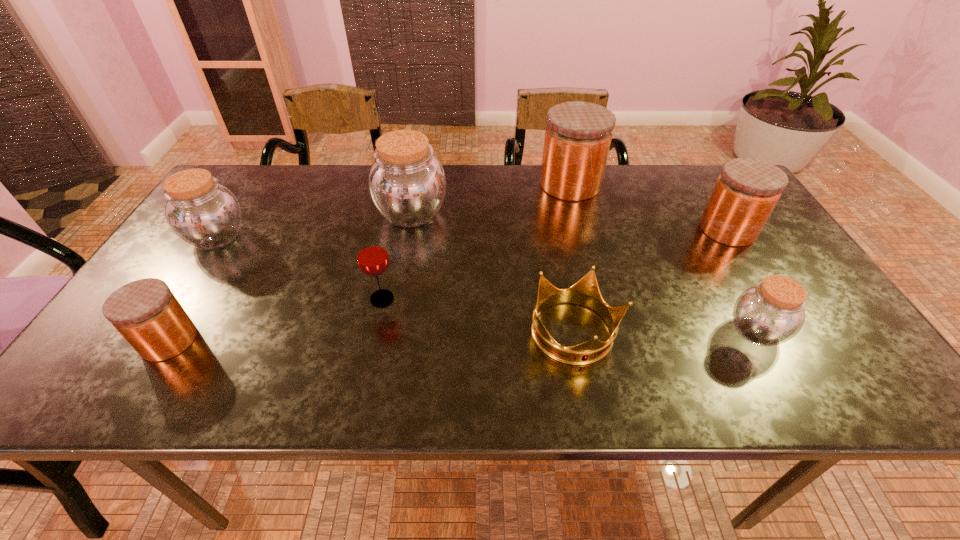
Find the location of a particular element. the nearest brown jar is located at coordinates pos(770,313).

The width and height of the screenshot is (960, 540). Find the location of `the smallest brown jar`. the smallest brown jar is located at coordinates (770, 313).

Find the location of `crown`. crown is located at coordinates (586, 292).

This screenshot has width=960, height=540. I want to click on gold crown, so click(x=586, y=292).

Where is `vacant region located on the right of the farthest orange jar`? This screenshot has width=960, height=540. vacant region located on the right of the farthest orange jar is located at coordinates (710, 185).

You are a GUI agent. You are given a task and a screenshot of the screen. Output one action in this format:
    pyautogui.click(x=<x>, y=<y>)
    Task: Click on the free space located 0.330m on the front of the biggest brown jar
    This screenshot has width=960, height=540.
    Given the screenshot: What is the action you would take?
    pyautogui.click(x=390, y=335)

Identify the location of vacant point located 0.100m on the back of the second smallest orange jar. (705, 193).

The height and width of the screenshot is (540, 960). I want to click on vacant area located 0.110m on the right of the second biggest brown jar, so click(289, 237).

Image resolution: width=960 pixels, height=540 pixels. What are the coordinates of `blank area located on the left of the glass` in the screenshot? It's located at (277, 299).

The height and width of the screenshot is (540, 960). I want to click on blank space located 0.360m on the back of the smallest orange jar, so click(x=243, y=221).